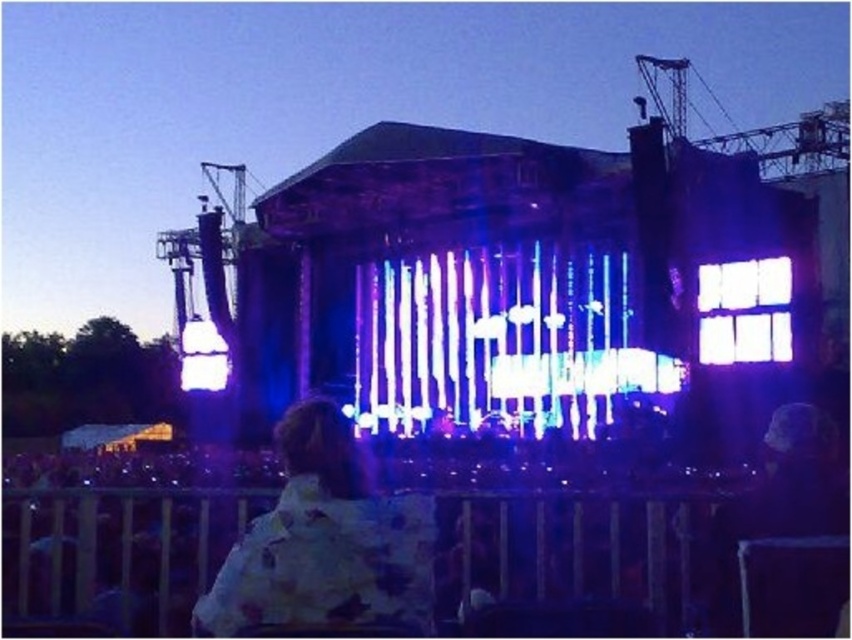
Question: Which object appears farthest from the camera in this image?

Choices:
 (A) floral-patterned jacket at center
 (B) neon glass tubes at center

Answer: (B)

Question: Is neon glass tubes at center smaller than floral-patterned jacket at center?

Choices:
 (A) yes
 (B) no

Answer: (B)

Question: Is neon glass tubes at center above floral-patterned jacket at center?

Choices:
 (A) no
 (B) yes

Answer: (B)

Question: Which of the following is the farthest from the observer?

Choices:
 (A) (378, 548)
 (B) (392, 301)

Answer: (B)

Question: Does neon glass tubes at center come in front of floral-patterned jacket at center?

Choices:
 (A) no
 (B) yes

Answer: (A)